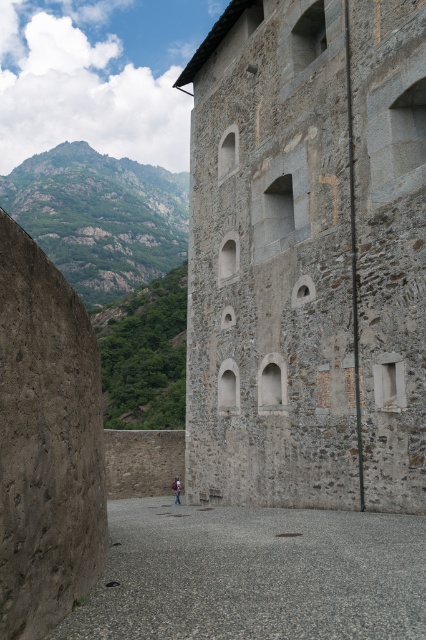
Question: In this image, where is gray gravel alley at center located relative to light brown leather jacket at lower center?

Choices:
 (A) below
 (B) above

Answer: (B)

Question: Is gray stone wall at center further to the viewer compared to gray gravel alley at center?

Choices:
 (A) yes
 (B) no

Answer: (A)

Question: Does gray stone wall at center have a smaller size compared to gray gravel alley at center?

Choices:
 (A) yes
 (B) no

Answer: (B)

Question: Which of the following is the farthest from the observer?

Choices:
 (A) gray stone wall at center
 (B) light brown leather jacket at lower center
 (C) gray gravel alley at center

Answer: (B)

Question: Which object is positioned closest to the light brown leather jacket at lower center?

Choices:
 (A) gray stone wall at center
 (B) gray gravel alley at center

Answer: (A)

Question: Which point is closer to the camera taking this photo?

Choices:
 (A) click(270, 561)
 (B) click(247, 403)
 (C) click(172, 486)

Answer: (A)